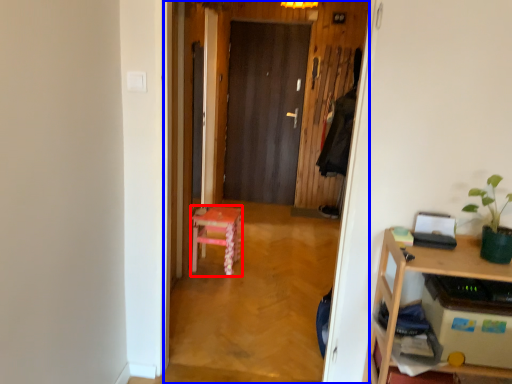
Question: Which object is closer to the camera taking this photo, stool (highlighted by a red box) or corridor (highlighted by a blue box)?

Choices:
 (A) stool
 (B) corridor

Answer: (B)